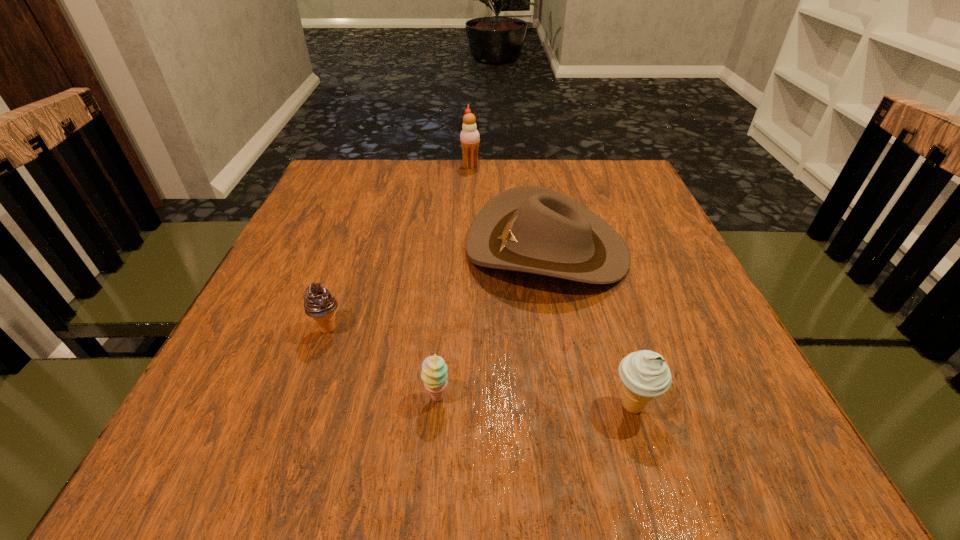
The width and height of the screenshot is (960, 540). What are the coordinates of `empty space that is in between the rightmost icecream and the leftmost object` in the screenshot? It's located at [481, 368].

Image resolution: width=960 pixels, height=540 pixels. Find the location of `empty space between the nearest icecream and the sherbert`. empty space between the nearest icecream and the sherbert is located at coordinates (535, 402).

Where is `free spot between the cowboy hat and the sherbert`? The height and width of the screenshot is (540, 960). free spot between the cowboy hat and the sherbert is located at coordinates (492, 323).

You are a GUI agent. You are given a task and a screenshot of the screen. Output one action in this format:
    pyautogui.click(x=<x>, y=<y>)
    Task: Click on the free space between the cowboy hat and the nearest icecream
    The width and height of the screenshot is (960, 540).
    Given the screenshot: What is the action you would take?
    pyautogui.click(x=589, y=328)

At what (x,y) coordinates should I click in order to perform the action: click on vacant point located between the leftmost icecream and the fourth nearest object. Please return your answer as a coordinate pair (x, y). This screenshot has width=960, height=540. Looking at the image, I should click on (438, 289).

I want to click on vacant area that lies between the cowboy hat and the nearest icecream, so click(589, 328).

Where is `object that is the fourth closest to the cowboy hat`? This screenshot has height=540, width=960. object that is the fourth closest to the cowboy hat is located at coordinates (319, 304).

Locate which object ranks in proximity to the sherbert. Please provide its 2D coordinates. Your answer should be formatted as a tuple, i.e. [(x, y)], where the tuple contains the x and y coordinates of a point satisfying the conditions above.

[(319, 304)]

Where is `the closest icecream to the nearest icecream`? This screenshot has width=960, height=540. the closest icecream to the nearest icecream is located at coordinates (319, 304).

Select which icecream is the closest to the second nearest icecream. Please provide its 2D coordinates. Your answer should be formatted as a tuple, i.e. [(x, y)], where the tuple contains the x and y coordinates of a point satisfying the conditions above.

[(645, 374)]